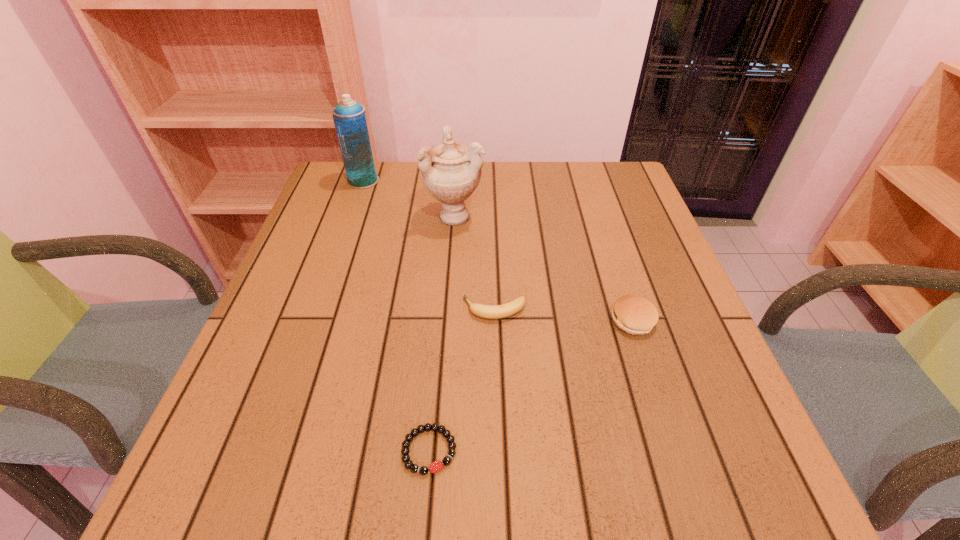
Where is `vacant region between the fourth nearest object and the nearest object`? This screenshot has height=540, width=960. vacant region between the fourth nearest object and the nearest object is located at coordinates (443, 333).

At what (x,y) coordinates should I click in order to perform the action: click on free area in between the fourth nearest object and the rightmost object. Please return your answer as a coordinate pair (x, y). Image resolution: width=960 pixels, height=540 pixels. Looking at the image, I should click on (544, 268).

Image resolution: width=960 pixels, height=540 pixels. Identify the location of free point between the patty and the nearest object. (531, 386).

The height and width of the screenshot is (540, 960). Find the location of `empty space that is in between the second farthest object and the banana`. empty space that is in between the second farthest object and the banana is located at coordinates (475, 262).

At what (x,y) coordinates should I click in order to perform the action: click on empty location between the third shortest object and the second farthest object. Please return your answer as a coordinate pair (x, y). This screenshot has height=540, width=960. Looking at the image, I should click on (544, 268).

You are a GUI agent. You are given a task and a screenshot of the screen. Output one action in this format:
    pyautogui.click(x=<x>, y=<y>)
    Task: Click on the free area in between the second farthest object and the banana
    Image resolution: width=960 pixels, height=540 pixels.
    Given the screenshot: What is the action you would take?
    pyautogui.click(x=475, y=262)

Select which object is the second closest to the second shortest object. Please provide its 2D coordinates. Your answer should be formatted as a tuple, i.e. [(x, y)], where the tuple contains the x and y coordinates of a point satisfying the conditions above.

[(451, 172)]

Point out which object is positioned as the second nearest to the banana. Please provide its 2D coordinates. Your answer should be formatted as a tuple, i.e. [(x, y)], where the tuple contains the x and y coordinates of a point satisfying the conditions above.

[(451, 172)]

I want to click on blank space that satisfies the following two spatial constraints: 1. at the stem of the third shortest object; 2. on the right side of the banana, so click(x=494, y=320).

The width and height of the screenshot is (960, 540). In order to click on vacant space that satisfies the following two spatial constraints: 1. on the front side of the farthest object; 2. on the right side of the patty in this screenshot , I will do `click(314, 320)`.